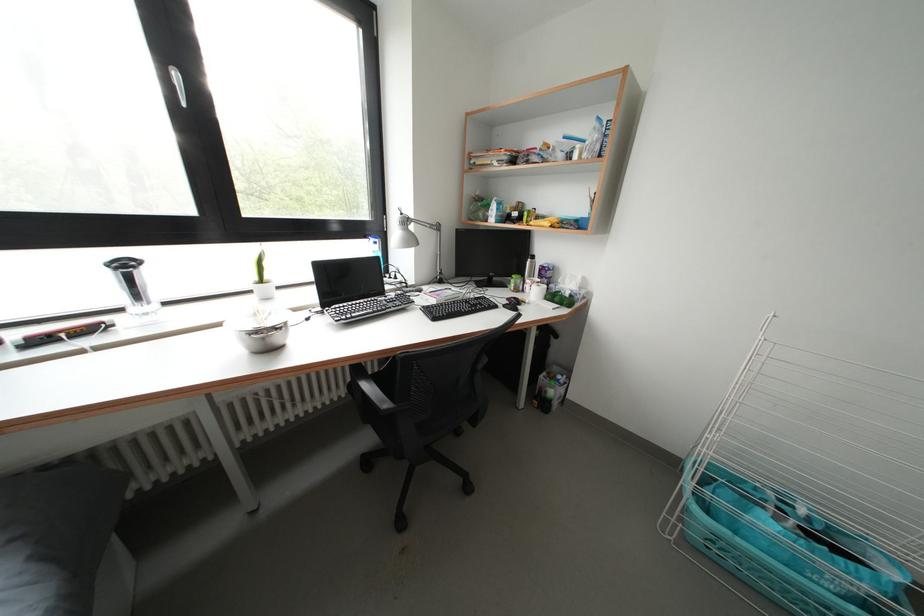
Where is `white lamp head`? The width and height of the screenshot is (924, 616). white lamp head is located at coordinates (403, 233).